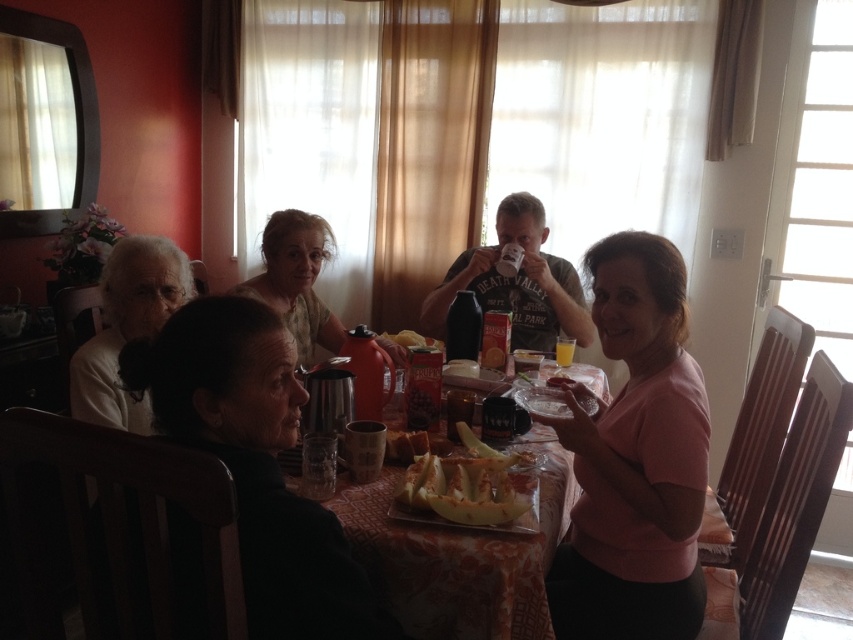
Which is behind, point (415, 528) or point (300, 340)?

The point (300, 340) is more distant.

Can you confirm if orange printed tablecloth at center is positioned to the left of matte yellow shirt at center?

Result: Incorrect, orange printed tablecloth at center is not on the left side of matte yellow shirt at center.

Between point (439, 566) and point (276, 292), which one is positioned behind?

The point (276, 292) is more distant.

In order to click on orange printed tablecloth at center in this screenshot , I will do `click(460, 557)`.

Can you confirm if dark brown hair at lower left is bigger than white matte hair at left?

Yes, dark brown hair at lower left is bigger than white matte hair at left.

Is dark brown hair at lower left in front of white matte hair at left?

That is True.

This screenshot has height=640, width=853. What are the coordinates of `dark brown hair at lower left` in the screenshot? It's located at (256, 464).

Does point (368, 560) lie in front of point (456, 458)?

Yes, it is in front of point (456, 458).

Can you confirm if orange printed tablecloth at center is positioned below sliced yellow melon at center?

Yes.

Who is more distant from viewer, (430, 442) or (457, 486)?

Positioned behind is point (430, 442).

I want to click on orange printed tablecloth at center, so click(460, 557).